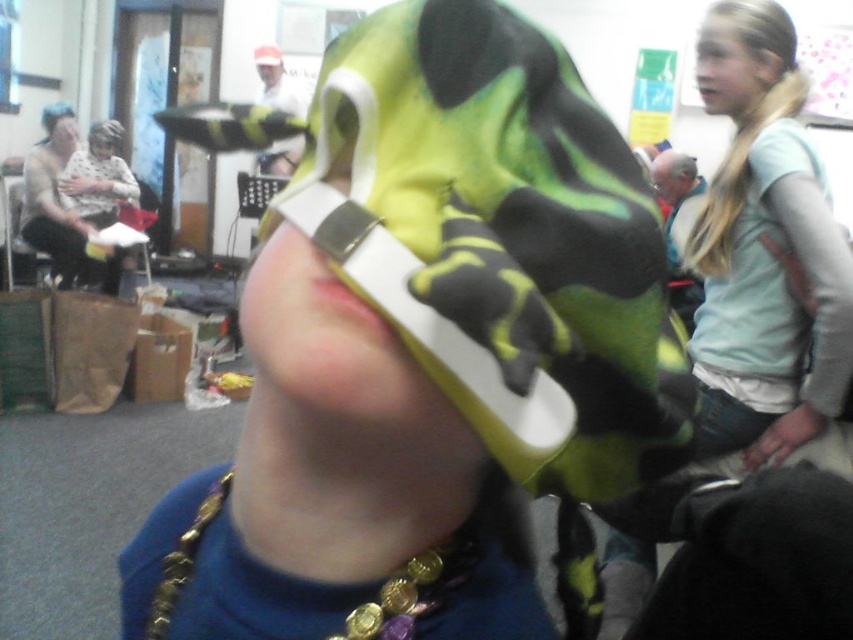
You are a photographer trying to capture a group photo of the blonde hair at upper right and the matte black face at upper left. Given that your camera has a maximum focus range of 3.5 meters, will both subjects be in focus?

The blonde hair at upper right and the matte black face at upper left are 3.70 meters apart, which exceeds the camera maximum focus range of 3.5 meters. Therefore, both subjects cannot be in focus simultaneously.

You are organizing a photo shoot and need to ensure that the matte black shirt at left and the matte black head at upper left are framed properly. Based on their sizes, which object should be placed closer to the camera to maintain proportional balance?

The matte black shirt at left might be wider than the matte black head at upper left, so to maintain proportional balance, the matte black head at upper left should be placed closer to the camera to appear larger and match the size of the matte black shirt at left.

You are standing in the scene and notice two objects labeled as matte black shirt at left and matte black head at upper left. Which one is positioned to the right of the other?

The matte black shirt at left is positioned to the right of the matte black head at upper left.